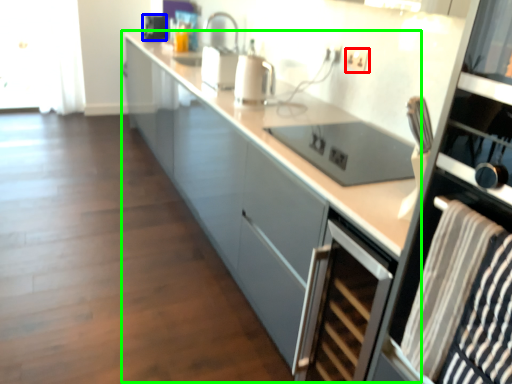
Question: Which object is the closest to the electric outlet (highlighted by a red box)? Choose among these: appliance (highlighted by a blue box) or cabinetry (highlighted by a green box).

Choices:
 (A) appliance
 (B) cabinetry

Answer: (B)